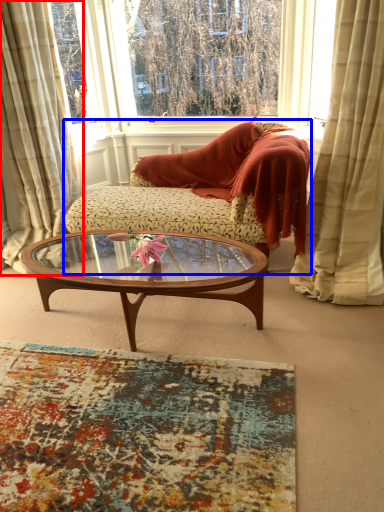
Question: Which object is closer to the camera taking this photo, curtain (highlighted by a red box) or studio couch (highlighted by a blue box)?

Choices:
 (A) curtain
 (B) studio couch

Answer: (A)